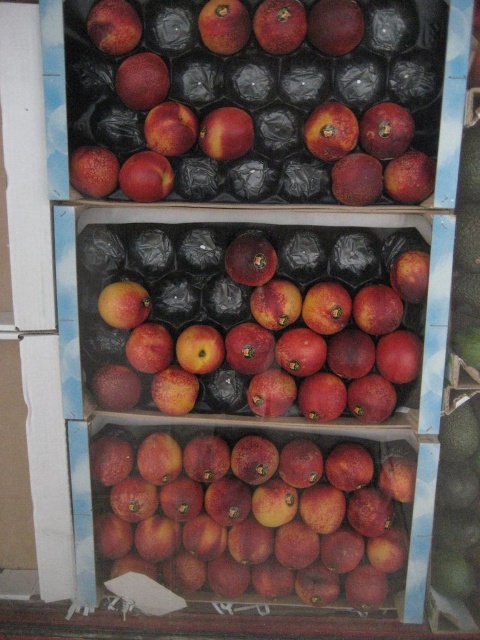
Question: Is glossy red peach at center to the right of matte red apple at upper left from the viewer's perspective?

Choices:
 (A) yes
 (B) no

Answer: (A)

Question: Which of the following is the farthest from the observer?

Choices:
 (A) (152, 124)
 (B) (183, 193)
 (C) (244, 134)

Answer: (B)

Question: Which object is the closest to the matte peach at upper center?

Choices:
 (A) glossy red apple at center
 (B) glossy red peaches at center
 (C) glossy red peach at upper center

Answer: (A)

Question: Which is nearer to the glossy red apple at center?

Choices:
 (A) glossy red peach at upper center
 (B) matte peach at upper center
 (C) glossy red peaches at center
 (D) glossy red peach at center

Answer: (B)

Question: Does glossy red peach at upper center have a larger size compared to matte red apple at upper left?

Choices:
 (A) no
 (B) yes

Answer: (B)

Question: In this image, where is glossy red peach at center located relative to matte red apple at upper left?

Choices:
 (A) below
 (B) above

Answer: (A)